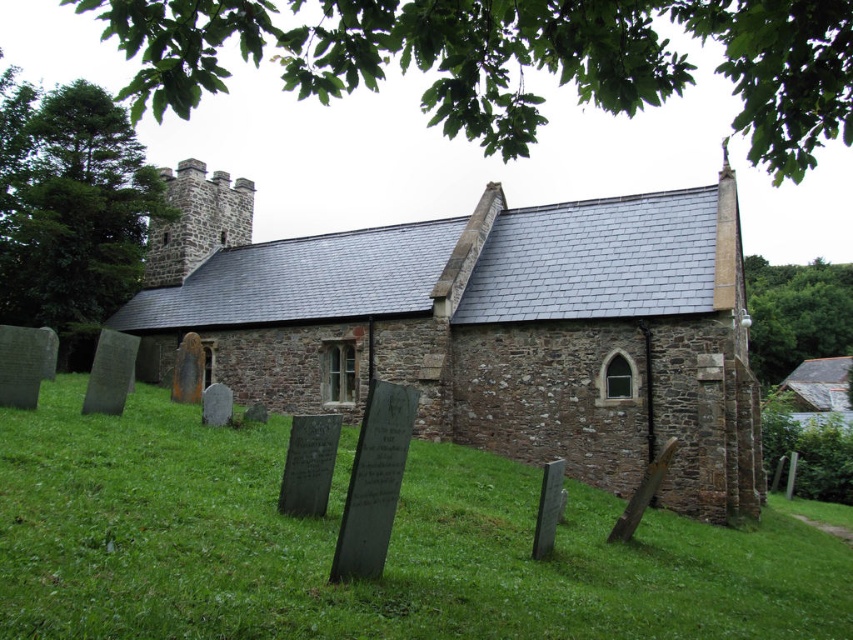
Question: Is green stone gravestones at lower left behind brown stone church at center?

Choices:
 (A) no
 (B) yes

Answer: (A)

Question: Which point is closer to the camera?

Choices:
 (A) brown stone church at center
 (B) green stone gravestones at lower left

Answer: (B)

Question: Observing the image, what is the correct spatial positioning of green stone gravestones at lower left in reference to brown stone church at center?

Choices:
 (A) left
 (B) right

Answer: (B)

Question: Which of the following is the farthest from the observer?

Choices:
 (A) green stone gravestones at lower left
 (B) brown stone church at center

Answer: (B)

Question: Does green stone gravestones at lower left appear over brown stone church at center?

Choices:
 (A) yes
 (B) no

Answer: (B)

Question: Which object is closer to the camera taking this photo?

Choices:
 (A) green stone gravestones at lower left
 (B) brown stone church at center

Answer: (A)